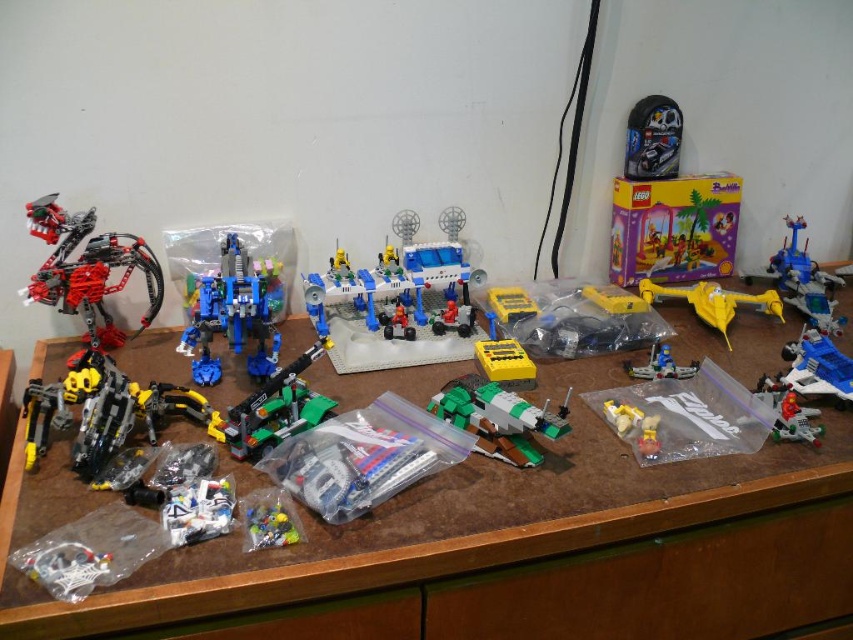
Question: Where is translucent blue plastic robot at center located in relation to translucent blue plastic spaceship at lower right in the image?

Choices:
 (A) above
 (B) below

Answer: (A)

Question: Which of the following is the closest to the observer?

Choices:
 (A) translucent blue plastic robot at center
 (B) translucent yellow plastic minifigures at center
 (C) black matte helmet at upper right

Answer: (B)

Question: Is shiny metallic robot at left positioned at the back of black matte helmet at upper right?

Choices:
 (A) yes
 (B) no

Answer: (B)

Question: Is translucent plastic toy at lower left smaller than white plastic toy at lower left?

Choices:
 (A) no
 (B) yes

Answer: (B)

Question: Which of the following is the closest to the observer?

Choices:
 (A) (28, 598)
 (B) (665, 99)

Answer: (A)

Question: Which object is the closest to the translucent plastic bag at center?

Choices:
 (A) translucent blue plastic robot at center
 (B) translucent yellow plastic minifigures at center
 (C) white plastic toy at lower left
 (D) green plastic car at center

Answer: (D)